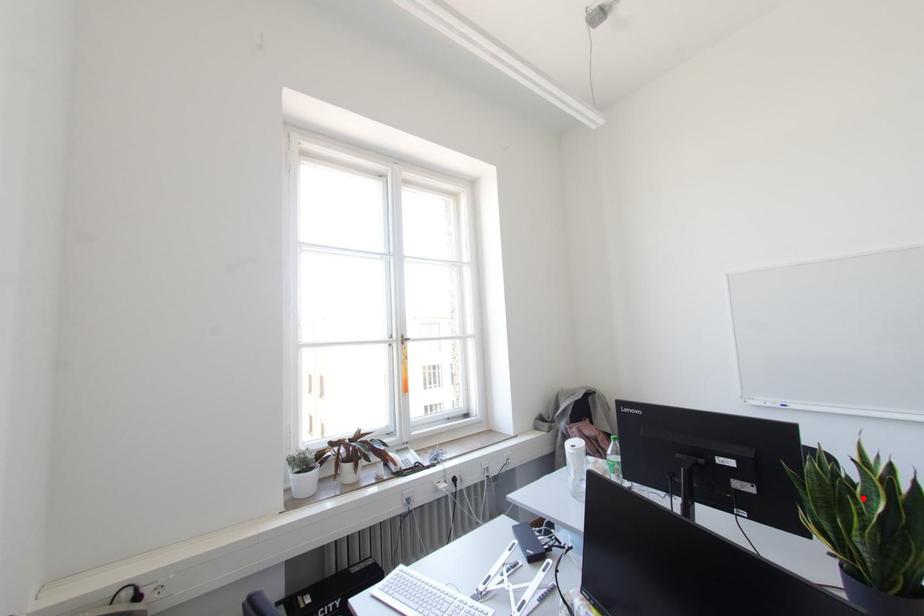
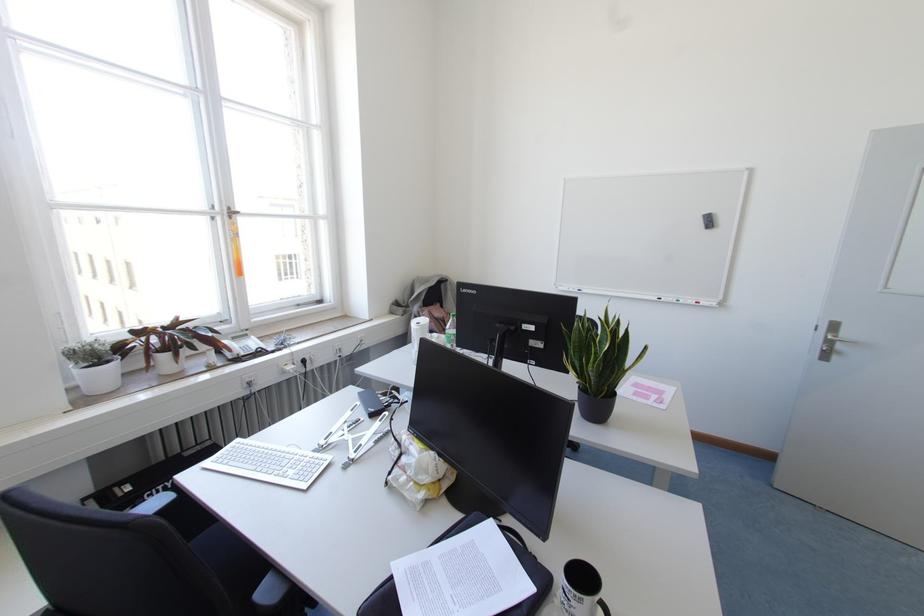
Question: I am providing you with two images of the same scene from different viewpoints. Given a red point in image1, look at the same physical point in image2. Is it:

Choices:
 (A) Closer to the viewpoint
 (B) Farther from the viewpoint

Answer: (B)